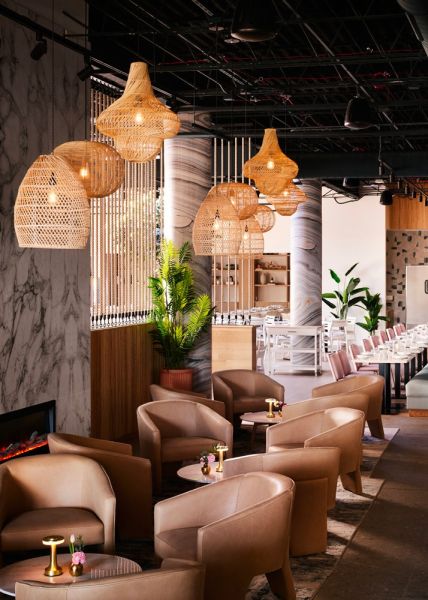
The width and height of the screenshot is (428, 600). I want to click on window, so click(131, 226).